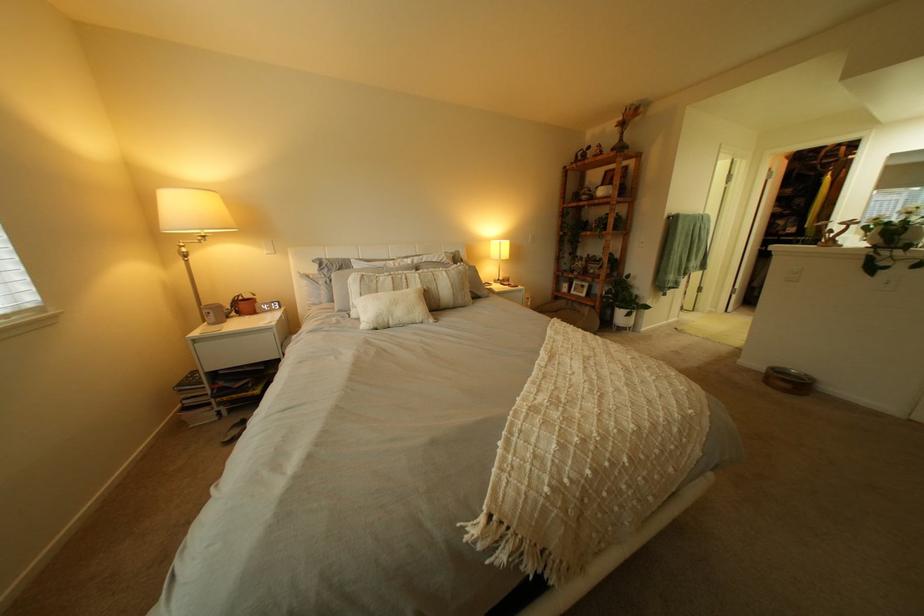
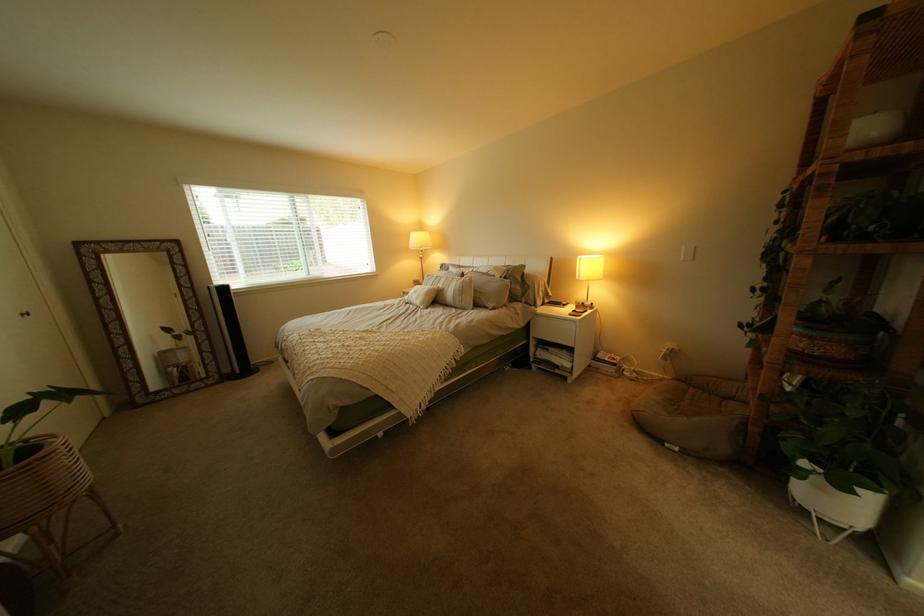
Locate, in the second image, the point that corresponds to pixel 623 276 in the first image.

(805, 354)